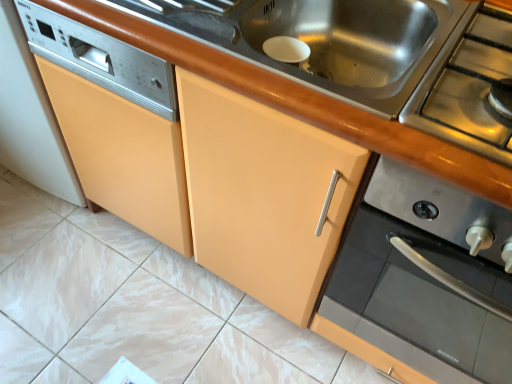
Find the location of a particular element. This screenshot has height=384, width=512. stainless steel stove at upper right is located at coordinates (424, 277).

Where is `gas stove located above the stainless steel sink at center (from a real-world perspective)`? gas stove located above the stainless steel sink at center (from a real-world perspective) is located at coordinates (467, 86).

Measure the distance from stainless steel sink at center to stainless steel gas stove at right.

They are 6.97 inches apart.

Could you tell me if stainless steel sink at center is facing stainless steel gas stove at right?

No, stainless steel sink at center is not aimed at stainless steel gas stove at right.

Does stainless steel sink at center have a lesser height compared to stainless steel gas stove at right?

In fact, stainless steel sink at center may be taller than stainless steel gas stove at right.

From the image's perspective, is stainless steel gas stove at right above or below stainless steel sink at center?

stainless steel gas stove at right is below stainless steel sink at center.

You are a GUI agent. You are given a task and a screenshot of the screen. Output one action in this format:
    pyautogui.click(x=<x>, y=<y>)
    Task: Click on the gas stove in front of the stainless steel sink at center
    
    Given the screenshot: What is the action you would take?
    pyautogui.click(x=467, y=86)

Measure the distance from stainless steel gas stove at right to stainless steel sink at center.

17.71 centimeters.

From the picture: Relative to stainless steel sink at center, is stainless steel gas stove at right in front or behind?

stainless steel gas stove at right is positioned closer to the viewer than stainless steel sink at center.

From the picture: Who is smaller, stainless steel stove at upper right or stainless steel sink at center?

With smaller size is stainless steel sink at center.

Can you confirm if stainless steel stove at upper right is taller than stainless steel sink at center?

Indeed, stainless steel stove at upper right has a greater height compared to stainless steel sink at center.

Is stainless steel stove at upper right aimed at stainless steel sink at center?

No, stainless steel stove at upper right does not turn towards stainless steel sink at center.

Would you say stainless steel stove at upper right is to the left or to the right of stainless steel gas stove at right in the picture?

In the image, stainless steel stove at upper right appears on the right side of stainless steel gas stove at right.

From the image's perspective, between stainless steel stove at upper right and stainless steel gas stove at right, which one is located above?

stainless steel gas stove at right appears higher in the image.

Who is shorter, stainless steel stove at upper right or stainless steel gas stove at right?

stainless steel gas stove at right.

Which object is wider, stainless steel stove at upper right or stainless steel gas stove at right?

Wider between the two is stainless steel stove at upper right.

From the image's perspective, would you say stainless steel gas stove at right is shown under stainless steel stove at upper right?

Incorrect, from the image's perspective, stainless steel gas stove at right is higher than stainless steel stove at upper right.

Measure the distance between stainless steel gas stove at right and stainless steel stove at upper right.

They are 12.26 inches apart.

Is stainless steel gas stove at right aimed at stainless steel stove at upper right?

No, stainless steel gas stove at right is not oriented towards stainless steel stove at upper right.

The height and width of the screenshot is (384, 512). I want to click on home appliance directly beneath the stainless steel sink at center (from a real-world perspective), so click(x=424, y=277).

Can you confirm if stainless steel sink at center is wider than stainless steel stove at upper right?

No, stainless steel sink at center is not wider than stainless steel stove at upper right.

Is stainless steel sink at center situated inside stainless steel stove at upper right or outside?

The correct answer is: outside.

Who is shorter, stainless steel sink at center or stainless steel stove at upper right?

stainless steel sink at center is shorter.

Image resolution: width=512 pixels, height=384 pixels. In the image, there is a stainless steel gas stove at right. Find the location of `sink above it (from the image's perspective)`. sink above it (from the image's perspective) is located at coordinates (322, 39).

Identify the location of gas stove above the stainless steel sink at center (from a real-world perspective). (467, 86).

Which object lies further to the anchor point stainless steel sink at center, stainless steel stove at upper right or stainless steel gas stove at right?

The object further to stainless steel sink at center is stainless steel stove at upper right.

Estimate the real-world distances between objects in this image. Which object is further from stainless steel stove at upper right, stainless steel gas stove at right or stainless steel sink at center?

Among the two, stainless steel sink at center is located further to stainless steel stove at upper right.

Based on their spatial positions, is stainless steel sink at center or stainless steel gas stove at right closer to stainless steel stove at upper right?

stainless steel gas stove at right is positioned closer to the anchor stainless steel stove at upper right.

Based on their spatial positions, is stainless steel gas stove at right or stainless steel stove at upper right further from stainless steel sink at center?

Based on the image, stainless steel stove at upper right appears to be further to stainless steel sink at center.

Estimate the real-world distances between objects in this image. Which object is closer to stainless steel gas stove at right, stainless steel stove at upper right or stainless steel sink at center?

stainless steel sink at center lies closer to stainless steel gas stove at right than the other object.

Based on their spatial positions, is stainless steel sink at center or stainless steel stove at upper right closer to stainless steel gas stove at right?

stainless steel sink at center is positioned closer to the anchor stainless steel gas stove at right.

Image resolution: width=512 pixels, height=384 pixels. I want to click on gas stove between stainless steel sink at center and stainless steel stove at upper right, so click(467, 86).